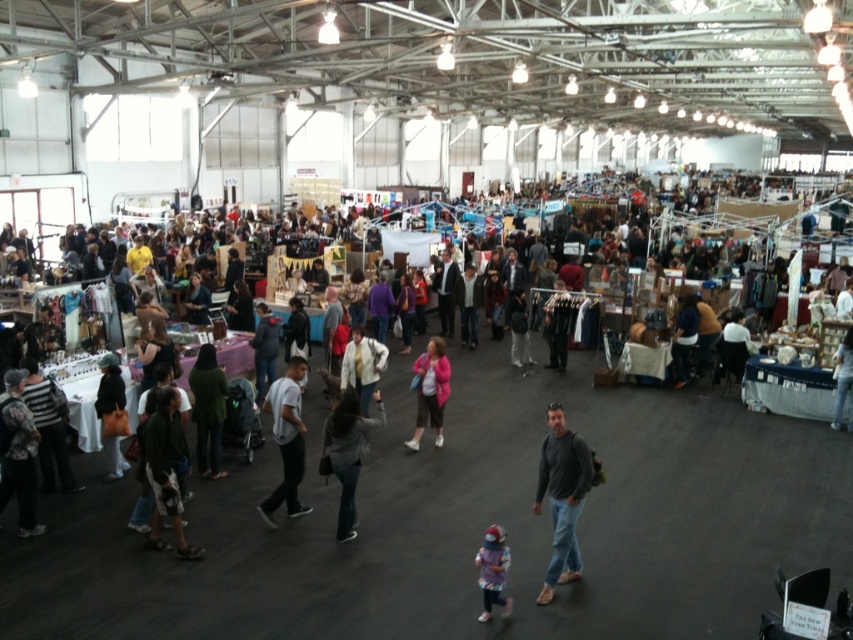
Question: Is gray cotton shirt at center to the left of dark gray sweater at center from the viewer's perspective?

Choices:
 (A) yes
 (B) no

Answer: (A)

Question: Which point is farther to the camera?

Choices:
 (A) (445, 372)
 (B) (19, 486)
 (C) (347, 406)
 (D) (292, 442)

Answer: (A)

Question: Which point appears closest to the camera in this image?

Choices:
 (A) (24, 426)
 (B) (498, 577)
 (C) (341, 413)
 (D) (408, 445)

Answer: (B)

Question: Is gray sweater at center further to the viewer compared to white cotton jacket at center?

Choices:
 (A) no
 (B) yes

Answer: (A)

Question: Is green fabric jacket at lower left positioned in front of purple fuzzy hat at center?

Choices:
 (A) no
 (B) yes

Answer: (A)

Question: Which object is positioned closest to the green fabric jacket at lower left?

Choices:
 (A) purple fuzzy hat at center
 (B) gray cotton shirt at center

Answer: (B)